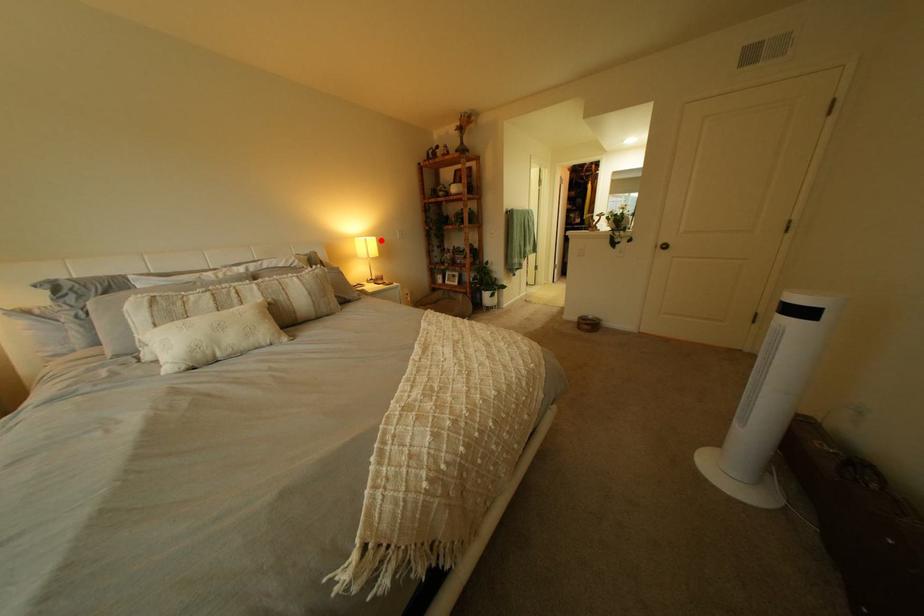
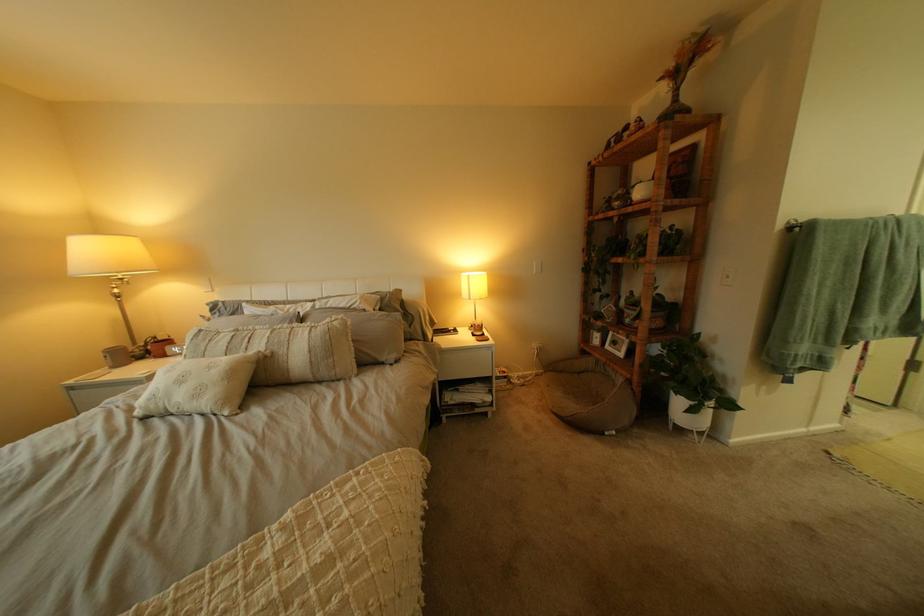
Question: I am providing you with two images of the same scene from different viewpoints. A red point is marked on the first image. Is the red point's position out of view in image 2?

Choices:
 (A) Yes
 (B) No

Answer: (B)